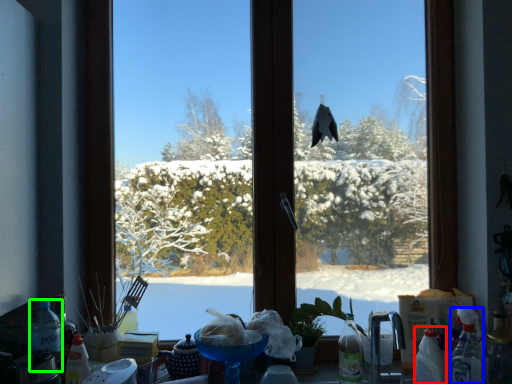
Question: Which is nearer to the bottle (highlighted by a red box)? bottle (highlighted by a blue box) or bottle (highlighted by a green box).

Choices:
 (A) bottle
 (B) bottle

Answer: (A)